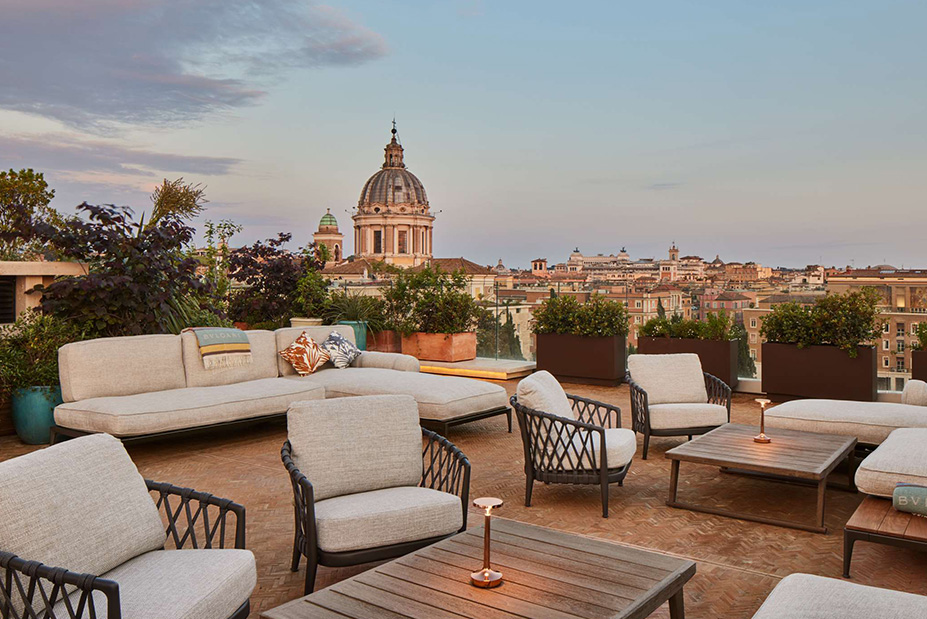
I want to click on white chair, so click(x=358, y=478), click(x=69, y=538), click(x=548, y=402), click(x=691, y=386).